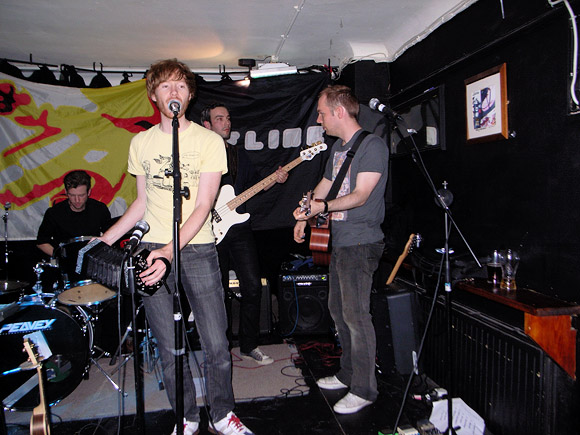
The image size is (580, 435). What are the coordinates of `wall` in the screenshot? It's located at (542, 168).